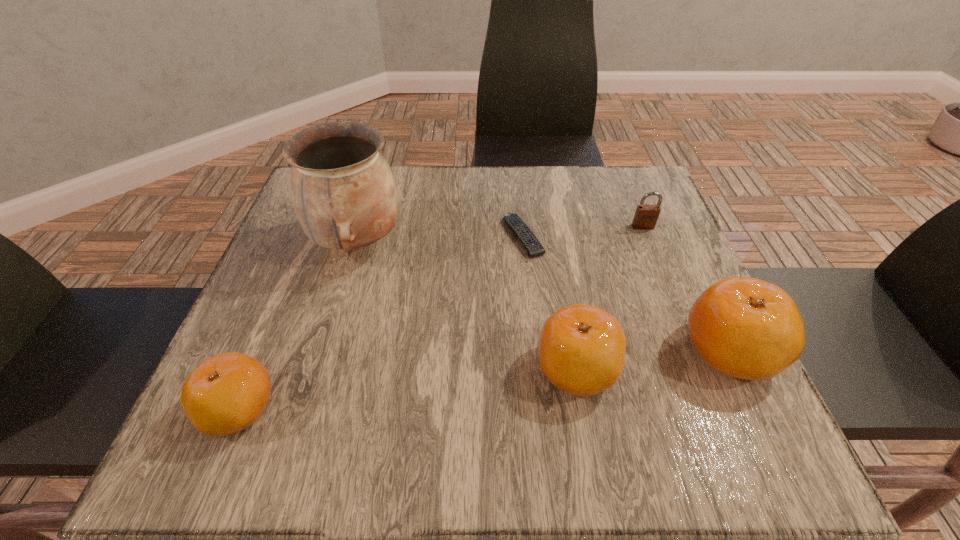
In order to click on the shortest clementine in this screenshot , I will do `click(225, 394)`.

Locate an element on the screen. This screenshot has height=540, width=960. the second clementine from right to left is located at coordinates (582, 348).

The height and width of the screenshot is (540, 960). Identify the location of the fourth shortest object. (582, 348).

This screenshot has height=540, width=960. I want to click on the rightmost clementine, so click(747, 328).

At what (x,y) coordinates should I click in order to perform the action: click on the shortest object. Please return your answer as a coordinate pair (x, y). This screenshot has height=540, width=960. Looking at the image, I should click on (534, 248).

Where is `the tallest object`? the tallest object is located at coordinates (344, 195).

You are a GUI agent. You are given a task and a screenshot of the screen. Output one action in this format:
    pyautogui.click(x=<x>, y=<y>)
    Task: Click on the padlock
    
    Given the screenshot: What is the action you would take?
    pyautogui.click(x=646, y=216)

Find the location of a particular element. The width and height of the screenshot is (960, 540). free spot located on the right of the leftmost clementine is located at coordinates (480, 409).

This screenshot has height=540, width=960. I want to click on blank space located on the left of the second clementine from right to left, so click(351, 369).

At what (x,y) coordinates should I click in order to perform the action: click on free spot located on the left of the rightmost clementine. Please return your answer as a coordinate pair (x, y). Looking at the image, I should click on (611, 351).